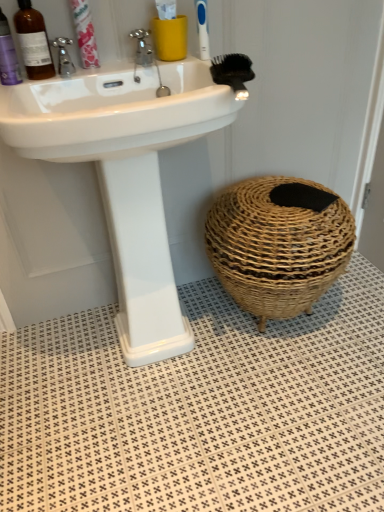
The width and height of the screenshot is (384, 512). I want to click on vacant area to the right of pink paper toothpaste at upper left, so click(135, 60).